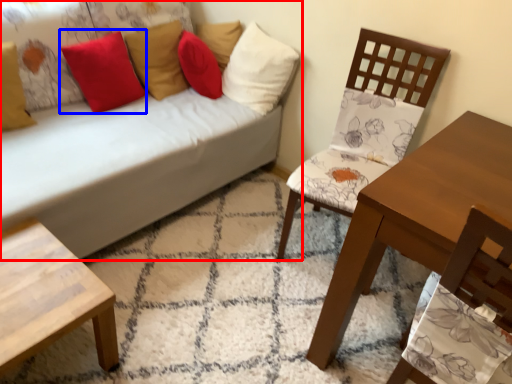
Question: Which object is further to the camera taking this photo, studio couch (highlighted by a red box) or pillow (highlighted by a blue box)?

Choices:
 (A) studio couch
 (B) pillow

Answer: (B)